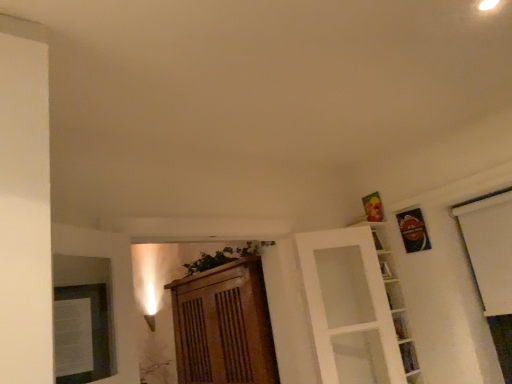
Question: Is white glass door at upper right taller than wooden cabinet at center?

Choices:
 (A) no
 (B) yes

Answer: (A)

Question: From the image's perspective, would you say white glass door at upper right is shown under wooden cabinet at center?

Choices:
 (A) no
 (B) yes

Answer: (A)

Question: Is white glass door at upper right oriented towards wooden cabinet at center?

Choices:
 (A) no
 (B) yes

Answer: (A)

Question: Does white glass door at upper right have a lesser height compared to wooden cabinet at center?

Choices:
 (A) no
 (B) yes

Answer: (B)

Question: Considering the relative positions of white glass door at upper right and wooden cabinet at center in the image provided, is white glass door at upper right to the left of wooden cabinet at center from the viewer's perspective?

Choices:
 (A) no
 (B) yes

Answer: (A)

Question: From a real-world perspective, is white glass door at upper right over wooden cabinet at center?

Choices:
 (A) no
 (B) yes

Answer: (B)

Question: Is white glass shelves at upper right, which is the second shelf in bottom-to-top order, smaller than wooden cabinet at center?

Choices:
 (A) yes
 (B) no

Answer: (A)

Question: Is white glass shelves at upper right, which is the second shelf in bottom-to-top order, shorter than wooden cabinet at center?

Choices:
 (A) no
 (B) yes

Answer: (A)

Question: Does white glass shelves at upper right, which is the second shelf in bottom-to-top order, appear on the left side of wooden cabinet at center?

Choices:
 (A) no
 (B) yes

Answer: (A)

Question: Can you confirm if white glass shelves at upper right, which is the second shelf in bottom-to-top order, is wider than wooden cabinet at center?

Choices:
 (A) no
 (B) yes

Answer: (A)

Question: Can you confirm if white glass shelves at upper right, placed as the 1th shelf when sorted from top to bottom, is taller than wooden cabinet at center?

Choices:
 (A) yes
 (B) no

Answer: (A)

Question: Is white glass shelves at upper right, placed as the 1th shelf when sorted from top to bottom, bigger than wooden cabinet at center?

Choices:
 (A) no
 (B) yes

Answer: (A)

Question: Is the position of clear glass shelf at lower right, which is counted as the second shelf, starting from the top, less distant than that of wooden cabinet at center?

Choices:
 (A) no
 (B) yes

Answer: (A)